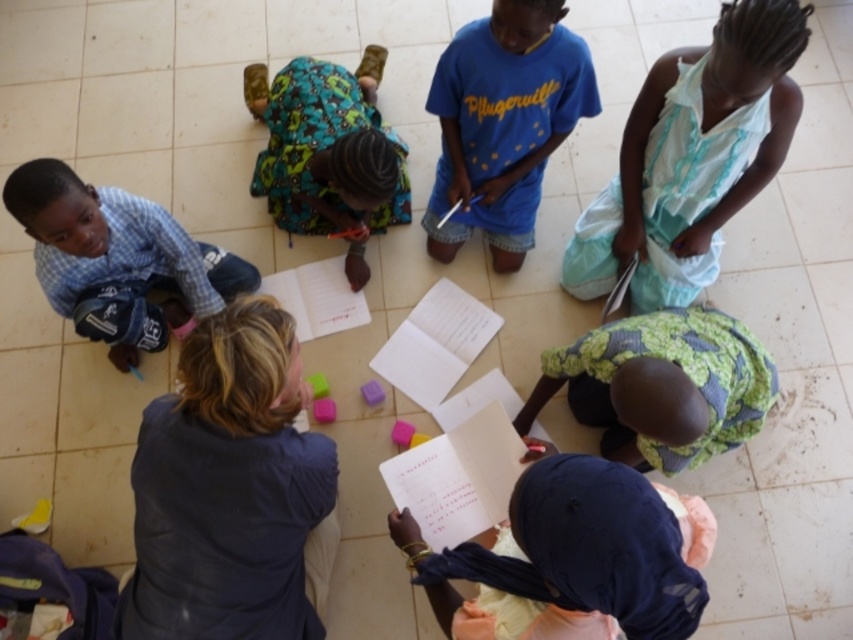
Does point (630, 204) come farther from viewer compared to point (114, 353)?

No, (630, 204) is closer to viewer.

Is white lace dress at upper right wider than checkered fabric shirt at left?

Correct, the width of white lace dress at upper right exceeds that of checkered fabric shirt at left.

Who is more distant from viewer, (x=729, y=122) or (x=186, y=312)?

Point (x=186, y=312)

Where is `white lace dress at upper right`? The height and width of the screenshot is (640, 853). white lace dress at upper right is located at coordinates (692, 156).

Who is shorter, green textured cloth at lower right or checkered fabric shirt at left?

green textured cloth at lower right

Between point (728, 438) and point (184, 312), which one is positioned in front?

Positioned in front is point (728, 438).

Locate an element on the screen. The width and height of the screenshot is (853, 640). green textured cloth at lower right is located at coordinates pyautogui.click(x=662, y=385).

Does white lace dress at upper right lie behind green textured cloth at lower right?

That is True.

Does white lace dress at upper right have a greater width compared to green textured cloth at lower right?

Incorrect, white lace dress at upper right's width does not surpass green textured cloth at lower right's.

Which is in front, point (779, 65) or point (598, 401)?

Point (779, 65) is more forward.

Where is `white lace dress at upper right`? white lace dress at upper right is located at coordinates (692, 156).